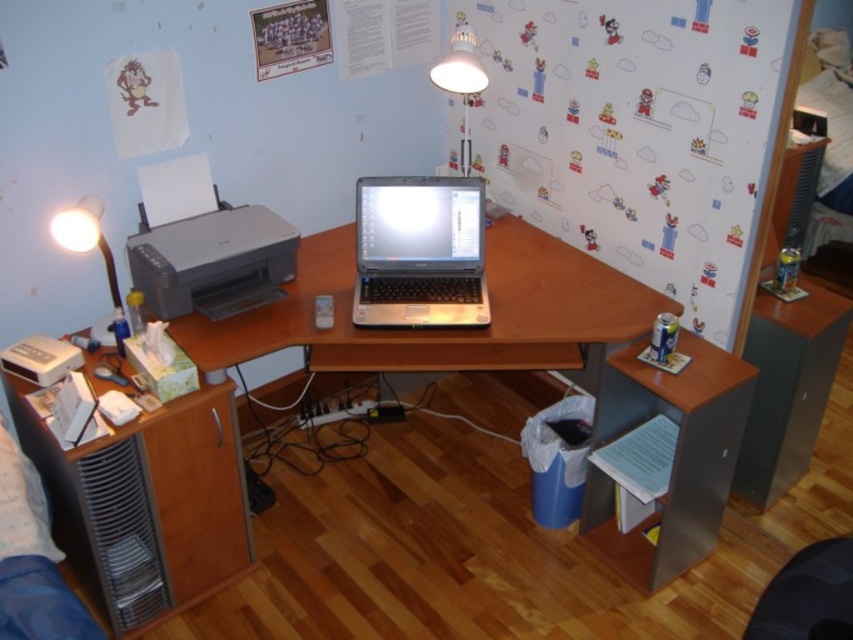
In the scene shown: Does white paperboard at center appear over black leather chair at lower right?

Yes, white paperboard at center is above black leather chair at lower right.

Is white paperboard at center taller than black leather chair at lower right?

Indeed, white paperboard at center has a greater height compared to black leather chair at lower right.

What do you see at coordinates (641, 132) in the screenshot? I see `white paperboard at center` at bounding box center [641, 132].

At what (x,y) coordinates should I click in order to perform the action: click on white paperboard at center. Please return your answer as a coordinate pair (x, y). The height and width of the screenshot is (640, 853). Looking at the image, I should click on (641, 132).

Does silver metallic laptop at center have a lesser height compared to white plastic lamp at upper left?

Incorrect, silver metallic laptop at center's height does not fall short of white plastic lamp at upper left's.

Which is below, silver metallic laptop at center or white plastic lamp at upper left?

Positioned lower is white plastic lamp at upper left.

Find the location of a particular element. The height and width of the screenshot is (640, 853). silver metallic laptop at center is located at coordinates (419, 252).

Which is in front, point (804, 586) or point (468, 170)?

Point (804, 586) is more forward.

Between point (782, 595) and point (457, 48), which one is positioned behind?

Point (457, 48)

The width and height of the screenshot is (853, 640). I want to click on black leather chair at lower right, so click(x=807, y=595).